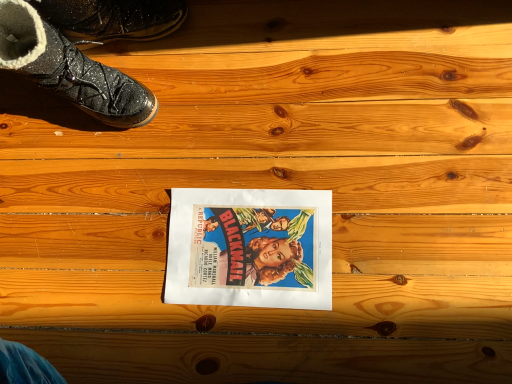
Find the location of a particular element. This screenshot has height=384, width=512. space that is in front of shiny black boot at upper left, the first footwear in the bottom-to-top sequence is located at coordinates (126, 180).